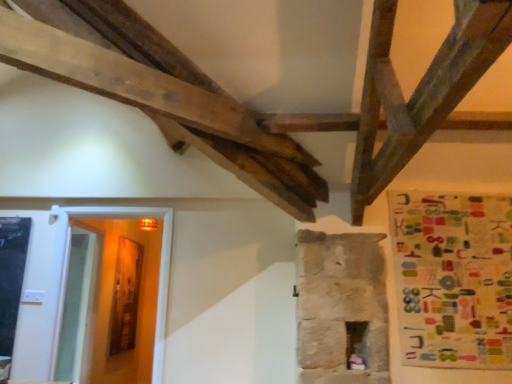
The image size is (512, 384). Identify the location of multicolored fabric poster at right. (453, 279).

This screenshot has width=512, height=384. What do you see at coordinates (453, 279) in the screenshot?
I see `multicolored fabric poster at right` at bounding box center [453, 279].

Locate an element on the screen. The height and width of the screenshot is (384, 512). transparent glass door at lower left is located at coordinates (159, 271).

The height and width of the screenshot is (384, 512). Describe the element at coordinates (159, 271) in the screenshot. I see `transparent glass door at lower left` at that location.

Where is `multicolored fabric poster at right`? This screenshot has height=384, width=512. multicolored fabric poster at right is located at coordinates (453, 279).

Does transparent glass door at lower left appear on the left side of multicolored fabric poster at right?

Correct, you'll find transparent glass door at lower left to the left of multicolored fabric poster at right.

Considering the positions of objects transparent glass door at lower left and multicolored fabric poster at right in the image provided, who is in front, transparent glass door at lower left or multicolored fabric poster at right?

multicolored fabric poster at right is closer to the camera.

Which is behind, point (59, 278) or point (494, 264)?

The point (59, 278) is farther.

From the image's perspective, is transparent glass door at lower left located beneath multicolored fabric poster at right?

Yes, from the image's perspective, transparent glass door at lower left is below multicolored fabric poster at right.

From a real-world perspective, which is physically below, transparent glass door at lower left or multicolored fabric poster at right?

transparent glass door at lower left.

Which of these two, transparent glass door at lower left or multicolored fabric poster at right, is thinner?

multicolored fabric poster at right.

From the picture: Considering the sizes of objects transparent glass door at lower left and multicolored fabric poster at right in the image provided, who is shorter, transparent glass door at lower left or multicolored fabric poster at right?

Standing shorter between the two is multicolored fabric poster at right.

Considering the sizes of transparent glass door at lower left and multicolored fabric poster at right in the image, is transparent glass door at lower left bigger or smaller than multicolored fabric poster at right?

Considering their sizes, transparent glass door at lower left takes up more space than multicolored fabric poster at right.

Is transparent glass door at lower left located outside multicolored fabric poster at right?

Yes.

Based on the photo, is transparent glass door at lower left directly adjacent to multicolored fabric poster at right?

There is a gap between transparent glass door at lower left and multicolored fabric poster at right.

Is transparent glass door at lower left facing away from multicolored fabric poster at right?

transparent glass door at lower left does not have its back to multicolored fabric poster at right.

What's the angular difference between transparent glass door at lower left and multicolored fabric poster at right's facing directions?

The angular difference between transparent glass door at lower left and multicolored fabric poster at right is 0.129 degrees.

Image resolution: width=512 pixels, height=384 pixels. What are the coordinates of `glass door located below the multicolored fabric poster at right (from the image's perspective)` in the screenshot? It's located at (159, 271).

Is multicolored fabric poster at right at the left side of transparent glass door at lower left?

In fact, multicolored fabric poster at right is to the right of transparent glass door at lower left.

Who is more distant, multicolored fabric poster at right or transparent glass door at lower left?

transparent glass door at lower left is behind.

Is point (434, 352) less distant than point (166, 277)?

Yes.

From the image's perspective, is multicolored fabric poster at right above or below transparent glass door at lower left?

multicolored fabric poster at right is situated higher than transparent glass door at lower left in the image.

From a real-world perspective, which is physically below, multicolored fabric poster at right or transparent glass door at lower left?

In real-world perspective, transparent glass door at lower left is lower.

In terms of width, does multicolored fabric poster at right look wider or thinner when compared to transparent glass door at lower left?

multicolored fabric poster at right is thinner than transparent glass door at lower left.

Considering the sizes of objects multicolored fabric poster at right and transparent glass door at lower left in the image provided, who is shorter, multicolored fabric poster at right or transparent glass door at lower left?

With less height is multicolored fabric poster at right.

In the scene shown: Looking at the image, does multicolored fabric poster at right seem bigger or smaller compared to transparent glass door at lower left?

Considering their sizes, multicolored fabric poster at right takes up less space than transparent glass door at lower left.

Would you say multicolored fabric poster at right is outside transparent glass door at lower left?

Yes.

Would you consider multicolored fabric poster at right to be distant from transparent glass door at lower left?

multicolored fabric poster at right is positioned a significant distance from transparent glass door at lower left.

Is multicolored fabric poster at right oriented towards transparent glass door at lower left?

No, multicolored fabric poster at right is not turned towards transparent glass door at lower left.

Measure the distance from multicolored fabric poster at right to transparent glass door at lower left.

multicolored fabric poster at right and transparent glass door at lower left are 7.24 feet apart.

The image size is (512, 384). What are the coordinates of `poster on the right of transparent glass door at lower left` in the screenshot? It's located at (453, 279).

I want to click on glass door located behind the multicolored fabric poster at right, so (159, 271).

This screenshot has height=384, width=512. I want to click on poster lying on the right of transparent glass door at lower left, so click(x=453, y=279).